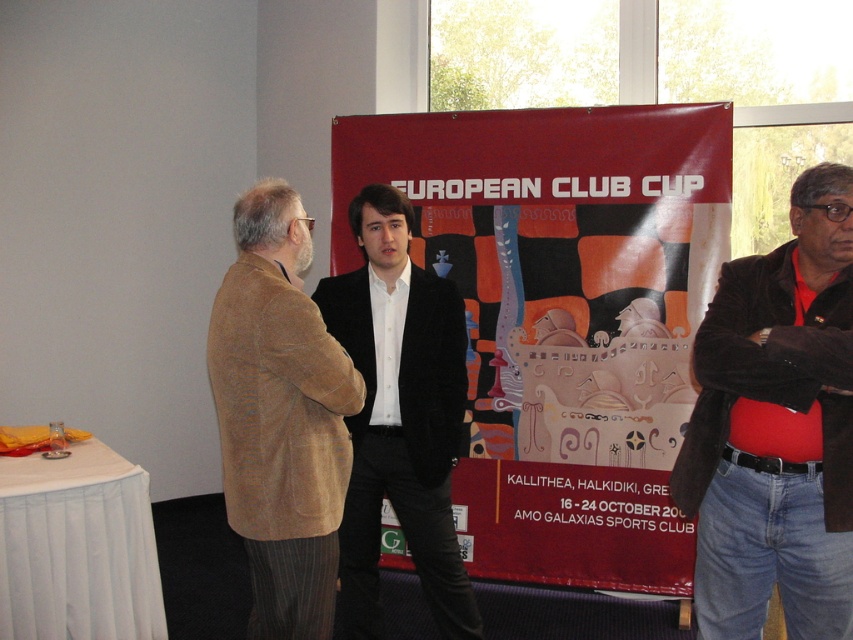
Is red fabric banner at center behind brown corduroy blazer at center?

Yes, red fabric banner at center is further from the viewer.

Who is more distant from viewer, [643,470] or [302,419]?

The point [643,470] is behind.

Where is `red fabric banner at center`? This screenshot has width=853, height=640. red fabric banner at center is located at coordinates (561, 317).

Does velvet brown jacket at right appear on the right side of black velvet blazer at center?

Correct, you'll find velvet brown jacket at right to the right of black velvet blazer at center.

Which is in front, point (833, 422) or point (350, 282)?

Point (833, 422)

The image size is (853, 640). I want to click on velvet brown jacket at right, so click(776, 428).

Between velvet brown jacket at right and brown corduroy blazer at center, which one appears on the left side from the viewer's perspective?

Positioned to the left is brown corduroy blazer at center.

What do you see at coordinates (776, 428) in the screenshot? I see `velvet brown jacket at right` at bounding box center [776, 428].

The height and width of the screenshot is (640, 853). I want to click on velvet brown jacket at right, so click(776, 428).